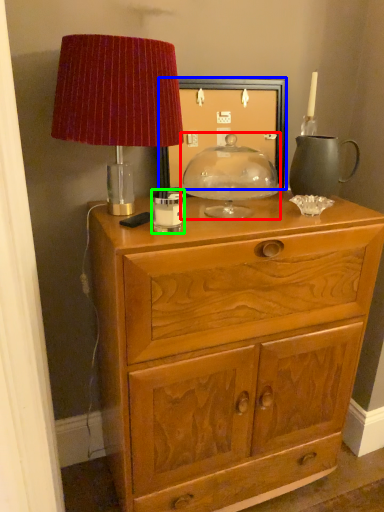
Question: Estimate the real-world distances between objects in this image. Which object is farther from candle holder (highlighted by a red box), picture frame (highlighted by a blue box) or candle holder (highlighted by a green box)?

Choices:
 (A) picture frame
 (B) candle holder

Answer: (B)